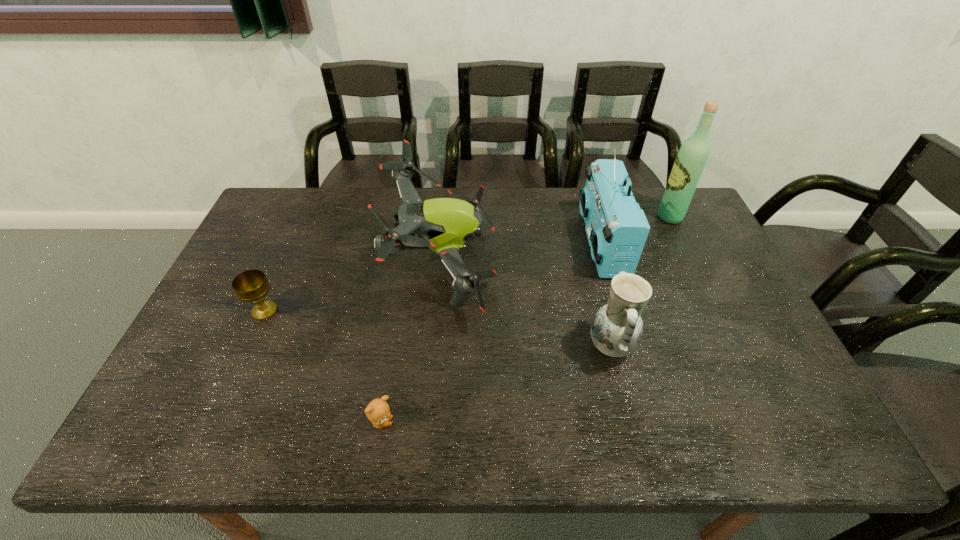
Find the location of a particular element. The height and width of the screenshot is (540, 960). the tallest object is located at coordinates (692, 157).

At what (x,y) coordinates should I click in order to perform the action: click on wine bottle. Please return your answer as a coordinate pair (x, y). This screenshot has height=540, width=960. Looking at the image, I should click on (692, 157).

Where is `drone`? The image size is (960, 540). drone is located at coordinates (444, 225).

At what (x,y) coordinates should I click in order to perform the action: click on radio receiver. Please return your answer as a coordinate pair (x, y). The width and height of the screenshot is (960, 540). Looking at the image, I should click on (617, 229).

Locate an element on the screen. This screenshot has height=540, width=960. the third shortest object is located at coordinates [x=617, y=328].

Locate an element on the screen. This screenshot has height=540, width=960. the leftmost object is located at coordinates (250, 286).

At what (x,y) coordinates should I click in order to perform the action: click on the second shortest object. Please return your answer as a coordinate pair (x, y). The width and height of the screenshot is (960, 540). Looking at the image, I should click on (250, 286).

The height and width of the screenshot is (540, 960). I want to click on teddy bear, so click(378, 412).

Find the location of `the nearest object`. the nearest object is located at coordinates pyautogui.click(x=378, y=412).

Locate an element on the screen. This screenshot has width=960, height=540. blank area located on the front-facing side of the wine bottle is located at coordinates (564, 217).